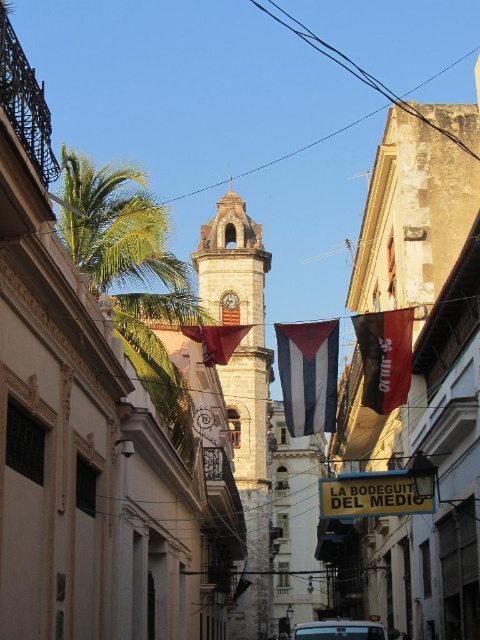
You are a tourist standing at the entrance of the street, looking towards the clock tower. You notice both the black fabric flag at center and the golden metallic clock at center. Which object is taller?

The black fabric flag at center is taller than the golden metallic clock at center.